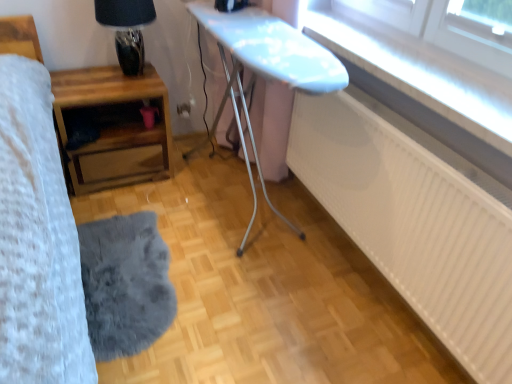
Identify the location of vacant space behind gray fluffy mat at lower left. (175, 205).